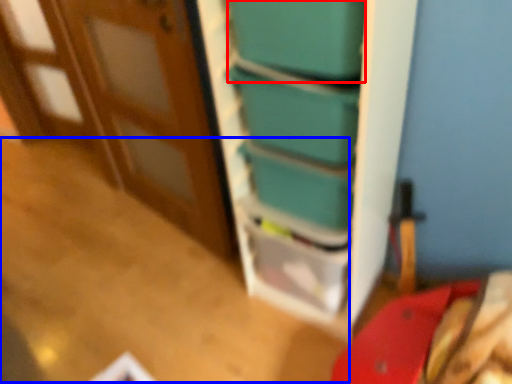
Question: Which point is further to the camera, box (highlighted by a red box) or table (highlighted by a blue box)?

Choices:
 (A) box
 (B) table

Answer: (B)